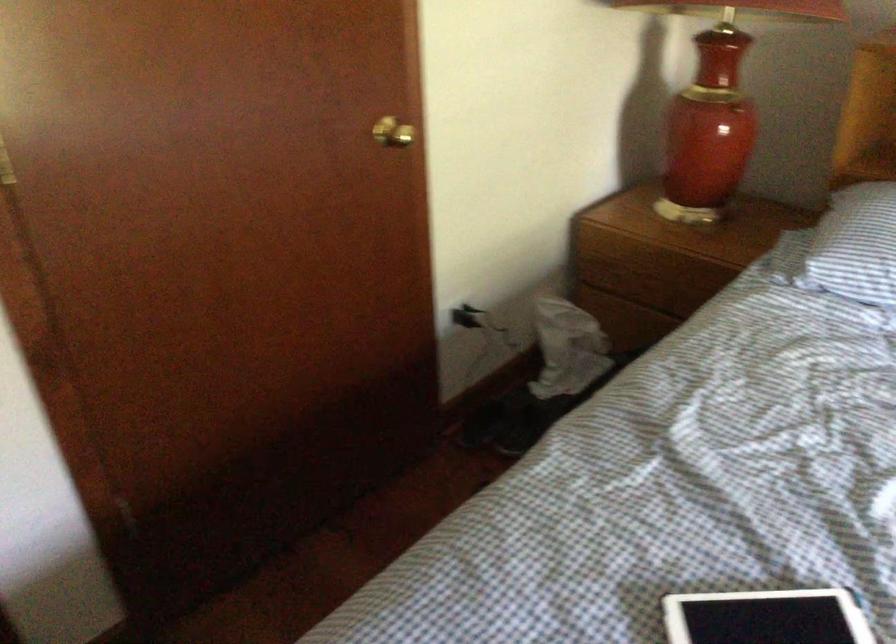
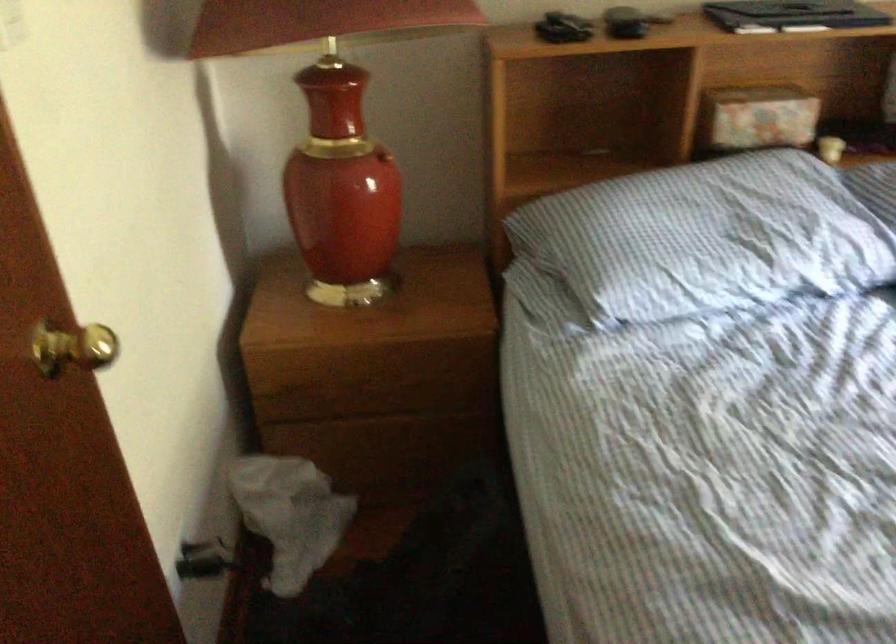
Find the pixel in the second image that matches pixel 485 328 in the first image.

(204, 560)